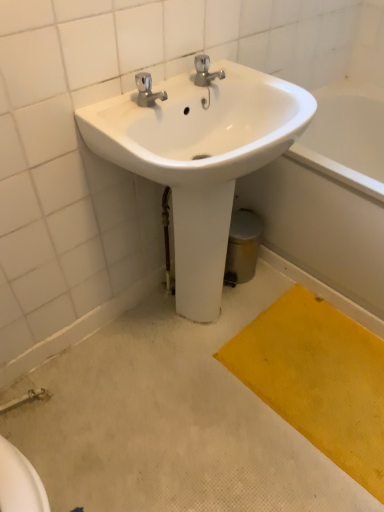
Question: From their relative heights in the image, would you say white glossy sink at upper center is taller or shorter than white glossy bathtub at lower right?

Choices:
 (A) short
 (B) tall

Answer: (B)

Question: Do you think white glossy sink at upper center is within white glossy bathtub at lower right, or outside of it?

Choices:
 (A) inside
 (B) outside

Answer: (B)

Question: Based on their relative distances, which object is farther from the yellow fabric doormat at lower right?

Choices:
 (A) white glossy bathtub at lower right
 (B) white glossy sink at upper center

Answer: (B)

Question: Which object is the farthest from the yellow fabric doormat at lower right?

Choices:
 (A) white glossy sink at upper center
 (B) white glossy bathtub at lower right

Answer: (A)